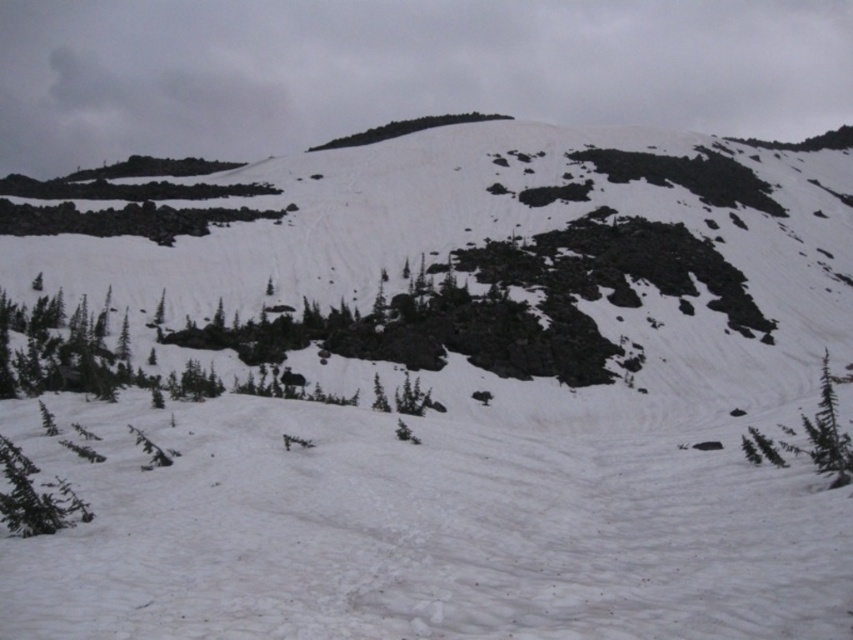
Who is taller, green matte tree at lower left or green leafy tree at upper center?

Standing taller between the two is green leafy tree at upper center.

Identify the location of green matte tree at lower left. (33, 497).

Which is in front, point (10, 504) or point (462, 115)?

Positioned in front is point (10, 504).

Locate an element on the screen. green matte tree at lower left is located at coordinates (33, 497).

Consider the image. Is green leafy tree at lower right taller than green leafy tree at upper center?

No.

Who is higher up, green leafy tree at lower right or green leafy tree at upper center?

green leafy tree at upper center is above.

This screenshot has height=640, width=853. Find the location of `green leafy tree at lower right`. green leafy tree at lower right is located at coordinates (827, 435).

The height and width of the screenshot is (640, 853). What are the coordinates of `green leafy tree at lower right` in the screenshot? It's located at (827, 435).

Does green matte tree at lower left appear under green leafy tree at lower right?

Correct, green matte tree at lower left is located below green leafy tree at lower right.

Does green matte tree at lower left appear over green leafy tree at lower right?

No, green matte tree at lower left is not above green leafy tree at lower right.

Does point (18, 476) come behind point (744, 454)?

No.

Where is `green matte tree at lower left`? Image resolution: width=853 pixels, height=640 pixels. green matte tree at lower left is located at coordinates (33, 497).